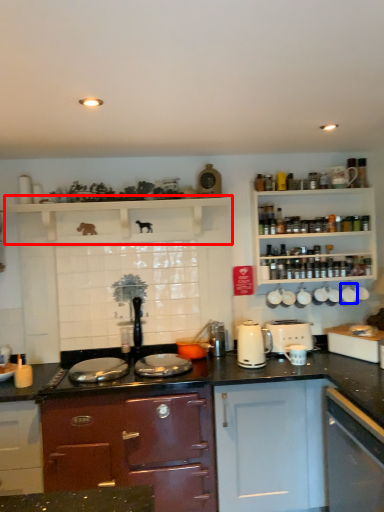
Question: Among these objects, which one is farthest to the camera, shelf (highlighted by a red box) or appliance (highlighted by a blue box)?

Choices:
 (A) shelf
 (B) appliance

Answer: (B)